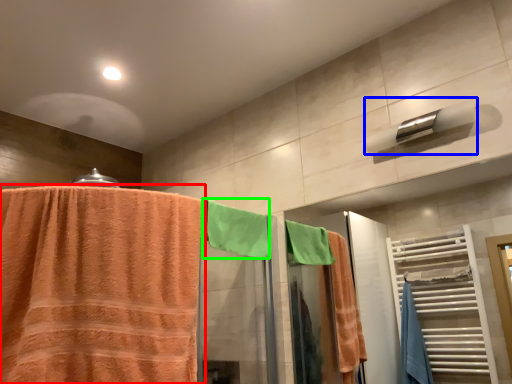
Question: Considering the real-world distances, which object is closest to towel (highlighted by a red box)? towel bar (highlighted by a blue box) or beach towel (highlighted by a green box).

Choices:
 (A) towel bar
 (B) beach towel

Answer: (B)